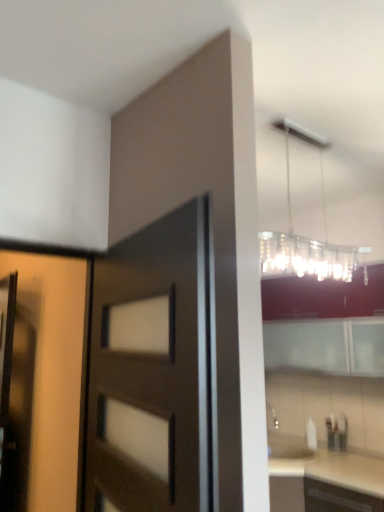
Question: Considering the positions of matte brown door at center, marked as the first door in a right-to-left arrangement, and matte wood door at left, acting as the second door starting from the right, in the image, is matte brown door at center, marked as the first door in a right-to-left arrangement, wider or thinner than matte wood door at left, acting as the second door starting from the right,?

Choices:
 (A) wide
 (B) thin

Answer: (A)

Question: Is matte brown door at center, marked as the first door in a right-to-left arrangement, to the left or to the right of matte wood door at left, acting as the second door starting from the right, in the image?

Choices:
 (A) right
 (B) left

Answer: (A)

Question: Estimate the real-world distances between objects in this image. Which object is farther from the matte brown screen door at left?

Choices:
 (A) clear glass chandelier at upper right
 (B) matte brown door at center, marked as the first door in a right-to-left arrangement
 (C) matte wood door at left, acting as the second door starting from the right
 (D) white glossy cabinet at upper right

Answer: (D)

Question: Which is nearer to the white glossy cabinet at upper right?

Choices:
 (A) clear glass chandelier at upper right
 (B) matte brown screen door at left
 (C) matte brown door at center, which ranks as the 2th door in left-to-right order
 (D) matte wood door at left, acting as the second door starting from the right

Answer: (A)